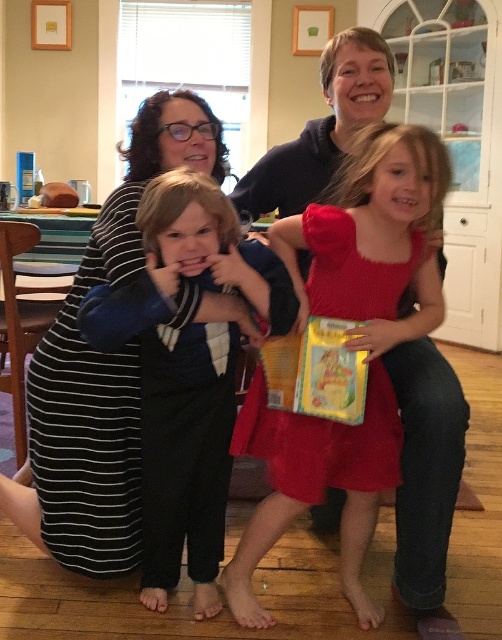
Question: From the image, what is the correct spatial relationship of blue cotton shirt at center in relation to red matte dress at center?

Choices:
 (A) above
 (B) below

Answer: (B)

Question: Based on their relative distances, which object is farther from the red matte dress at center?

Choices:
 (A) blue cotton shirt at center
 (B) striped fabric dress at left

Answer: (B)

Question: Is blue cotton shirt at center positioned before striped fabric dress at left?

Choices:
 (A) no
 (B) yes

Answer: (B)

Question: Is the position of blue cotton shirt at center less distant than that of striped fabric dress at left?

Choices:
 (A) no
 (B) yes

Answer: (B)

Question: Which object appears farthest from the camera in this image?

Choices:
 (A) blue cotton shirt at center
 (B) striped fabric dress at left

Answer: (B)

Question: Among these objects, which one is nearest to the camera?

Choices:
 (A) striped fabric dress at left
 (B) red matte dress at center

Answer: (A)